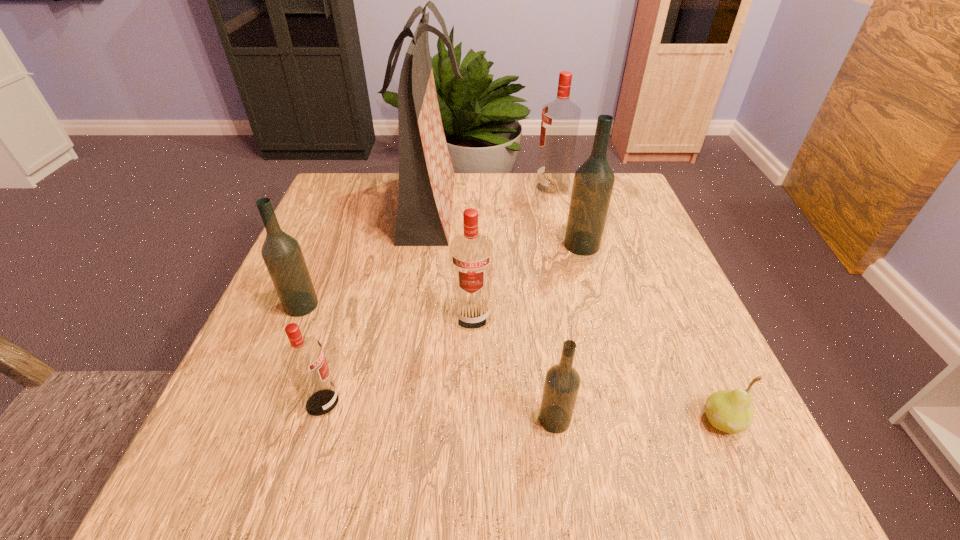
Identify the location of vacant region located 0.400m on the right of the leftmost black vodka. point(520,305).

Image resolution: width=960 pixels, height=540 pixels. Identify the location of vacant space situated on the front label of the third vodka from left to right. (470, 426).

Find the location of `vacant space located 0.190m on the front label of the second object from left to right`. vacant space located 0.190m on the front label of the second object from left to right is located at coordinates (458, 403).

This screenshot has height=540, width=960. What are the coordinates of `free spot located on the back of the third vodka from right to left` in the screenshot? It's located at (544, 342).

Identify the location of vacant space located on the left of the shortest object. (662, 421).

At what (x,y) coordinates should I click in order to perform the action: click on shopping bag at the far edge. Please return your answer as a coordinate pair (x, y). The height and width of the screenshot is (540, 960). Looking at the image, I should click on (426, 176).

This screenshot has width=960, height=540. Identify the location of vodka present at the far edge. (560, 119).

You are a GUI agent. You are given a task and a screenshot of the screen. Output one action in this format:
    pyautogui.click(x=<x>, y=<y>)
    Task: Click on the vodka situated at the right edge
    The width and height of the screenshot is (960, 540).
    Given the screenshot: What is the action you would take?
    pyautogui.click(x=593, y=183)

You are a GUI agent. You are given a task and a screenshot of the screen. Output one action in this format:
    pyautogui.click(x=<x>, y=<y>)
    Task: Click on the pear that is at the right edge
    
    Given the screenshot: What is the action you would take?
    pyautogui.click(x=731, y=411)

At what (x,y) coordinates should I click in order to perform the action: click on blank area at the far edge. Please return your answer as a coordinate pair (x, y). This screenshot has height=540, width=960. Looking at the image, I should click on (505, 192).